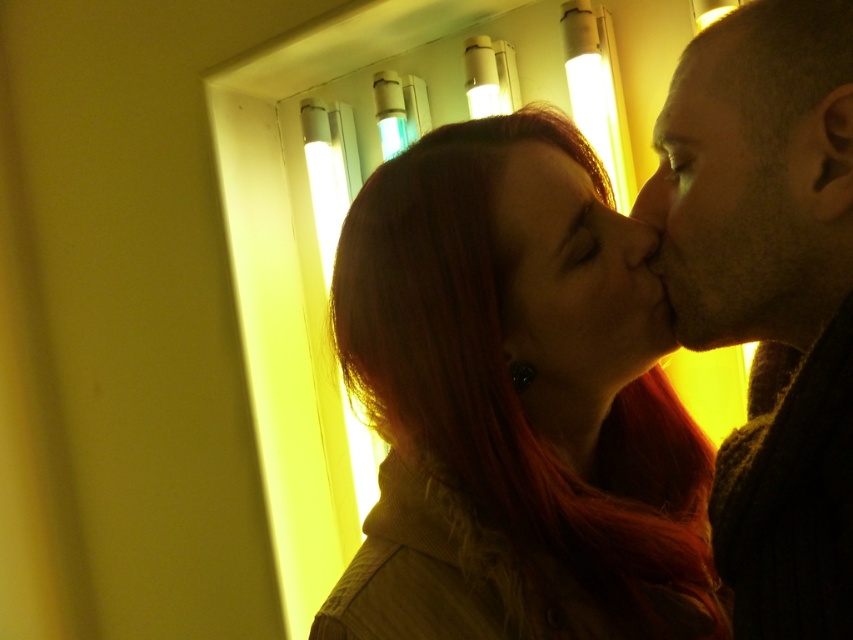
You are a photographer adjusting the lighting for a portrait. You notice the matte red hair at center and the matte skin nose at center in your frame. Which object should you adjust the light to highlight first if you want to ensure both are well lit, considering their size?

The matte red hair at center is much taller than the matte skin nose at center, so you should adjust the light to highlight the matte red hair at center first since it is larger and might require more focused lighting to ensure proper exposure.

You are an artist trying to sketch the scene. You need to locate the matte red hair at center. Where exactly is it positioned in the image?

The matte red hair at center is positioned at point (x=572, y=278).

You are a photographer adjusting lighting for a portrait. You notice the shiny red hair at center and the matte skin nose at right. Which object is closer to the left side of the frame?

The shiny red hair at center is closer to the left side of the frame than the matte skin nose at right.